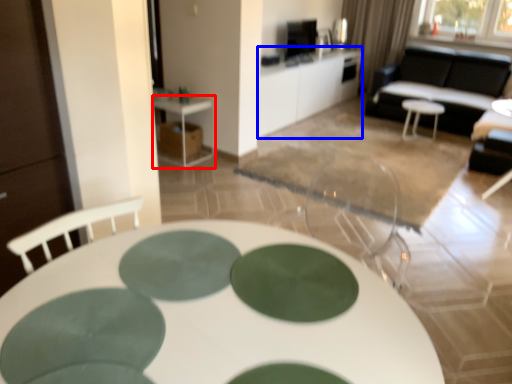
Question: Which object is further to the camera taking this photo, table (highlighted by a red box) or table (highlighted by a blue box)?

Choices:
 (A) table
 (B) table

Answer: (B)